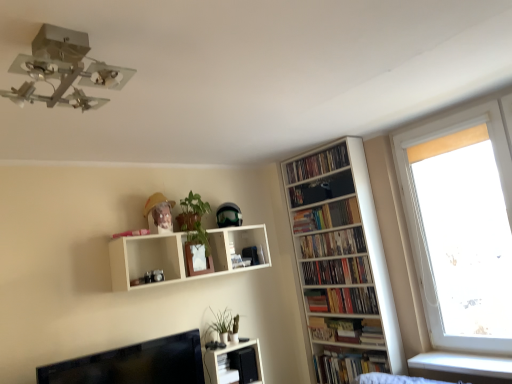
Question: Do you think hardcover books at lower right, which is counted as the 6th book, starting from the top, is within white wooden bookcase at right, or outside of it?

Choices:
 (A) outside
 (B) inside

Answer: (B)

Question: From their relative heights in the image, would you say hardcover books at lower right, which is counted as the 6th book, starting from the top, is taller or shorter than white wooden bookcase at right?

Choices:
 (A) short
 (B) tall

Answer: (A)

Question: Estimate the real-world distances between objects in this image. Which object is closer to the hardcover books at right, positioned as the third book in bottom-to-top order?

Choices:
 (A) white matte shelf at upper center, which is counted as the 1th shelf, starting from the top
 (B) white glossy shelf at lower center, the second shelf positioned from the top
 (C) black glossy monitor at lower left
 (D) wooden shelf at upper right, positioned as the sixth book in bottom-to-top order
 (E) green matte plant at upper center, placed as the 2th plant when sorted from bottom to top

Answer: (D)

Question: Estimate the real-world distances between objects in this image. Which object is closer to the metallic chrome light fixture at upper left?

Choices:
 (A) white wooden bookcase at right
 (B) wooden shelf at upper right, positioned as the sixth book in bottom-to-top order
 (C) hardcover books at center-right, placed as the 4th book when sorted from bottom to top
 (D) white matte shelf at upper center, which is counted as the 1th shelf, starting from the top
 (E) hardcover books at upper right, acting as the 2th book starting from the top

Answer: (D)